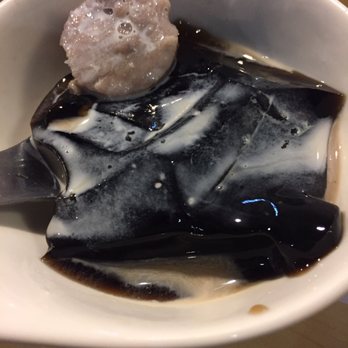
Locate an element on the screen. lights reflected is located at coordinates [x=317, y=229], [x=239, y=222].